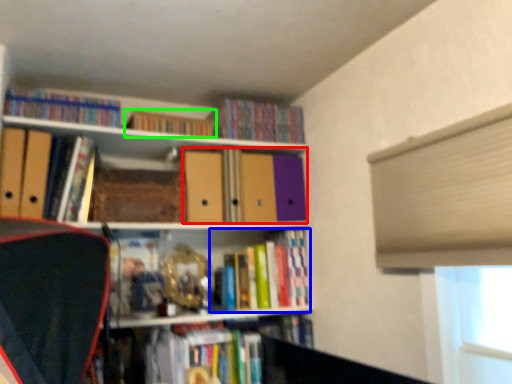
Question: Estimate the real-world distances between objects in this image. Which object is closer to book (highlighted by a red box), book (highlighted by a blue box) or book (highlighted by a green box)?

Choices:
 (A) book
 (B) book

Answer: (A)